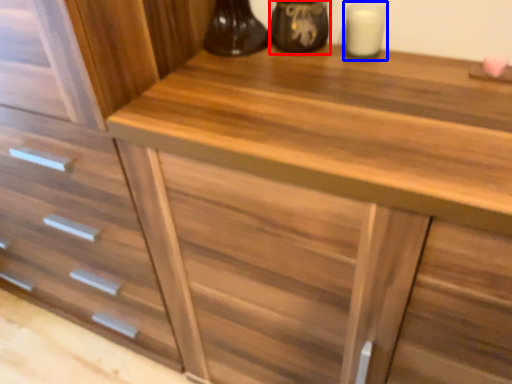
Question: Which object is further to the camera taking this photo, appliance (highlighted by a red box) or candle holder (highlighted by a blue box)?

Choices:
 (A) appliance
 (B) candle holder

Answer: (A)